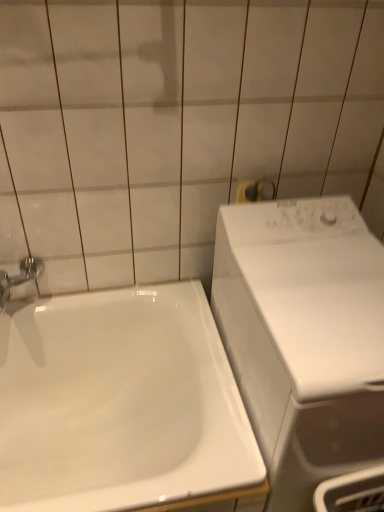
Question: From the image's perspective, is white glossy sink at lower left positioned above or below chrome metallic faucet at left?

Choices:
 (A) above
 (B) below

Answer: (B)

Question: Is white glossy sink at lower left to the left or to the right of chrome metallic faucet at left in the image?

Choices:
 (A) left
 (B) right

Answer: (B)

Question: Which object is the closest to the chrome metallic faucet at left?

Choices:
 (A) white glossy sink at lower left
 (B) white glossy washing machine at right

Answer: (A)

Question: Considering the real-world distances, which object is farthest from the white glossy washing machine at right?

Choices:
 (A) chrome metallic faucet at left
 (B) white glossy sink at lower left

Answer: (A)